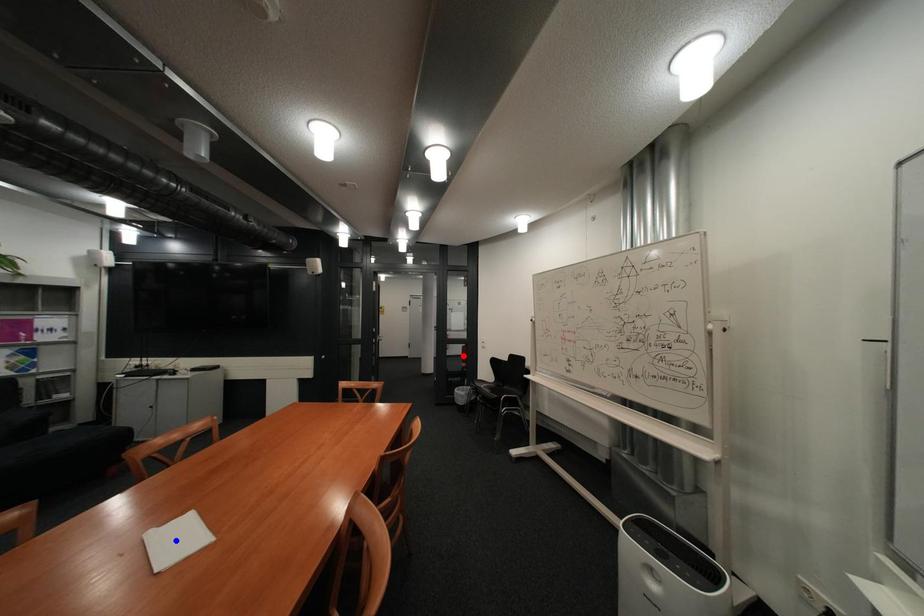
Question: In the image, two points are highlighted. Which point is nearer to the camera? Reply with the corresponding letter.

Choices:
 (A) blue point
 (B) red point

Answer: (A)